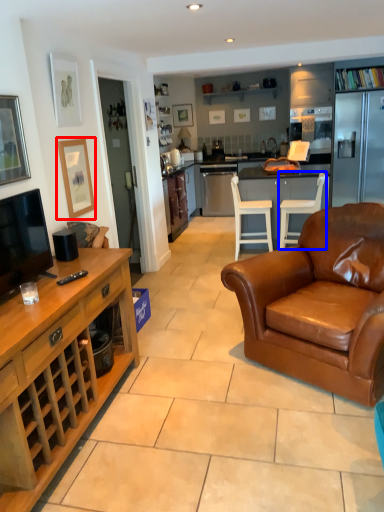
Question: Among these objects, which one is nearest to the camera, picture frame (highlighted by a red box) or chair (highlighted by a blue box)?

Choices:
 (A) picture frame
 (B) chair

Answer: (A)